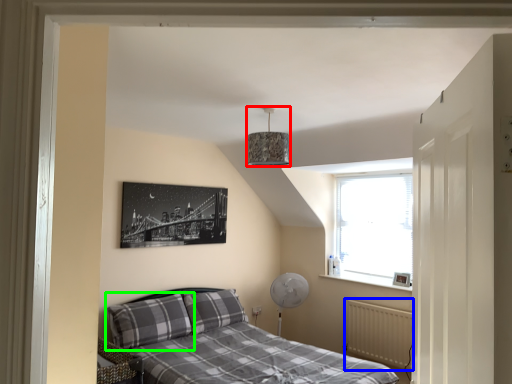
Question: Which is farther away from lamp (highlighted by a red box)? radiator (highlighted by a blue box) or pillow (highlighted by a green box)?

Choices:
 (A) radiator
 (B) pillow

Answer: (A)